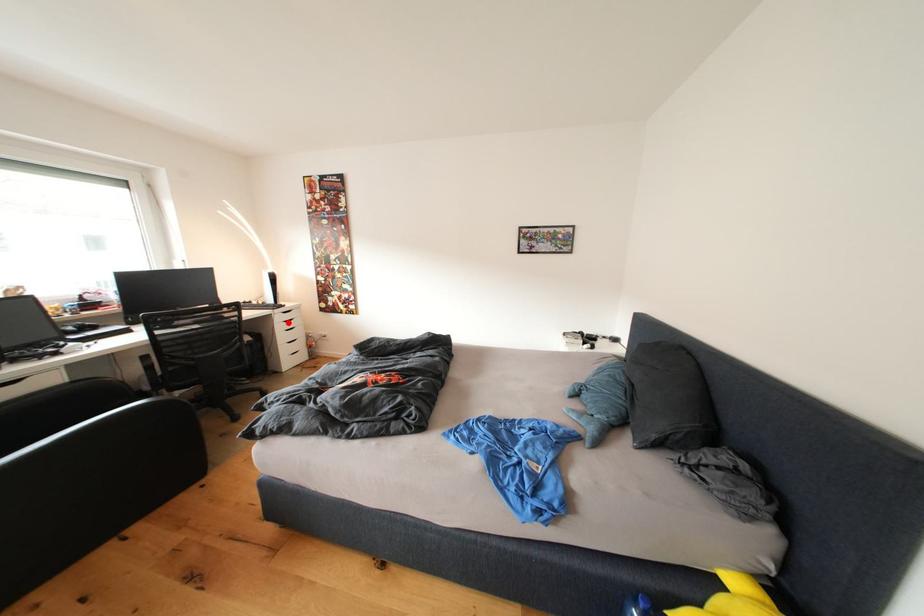
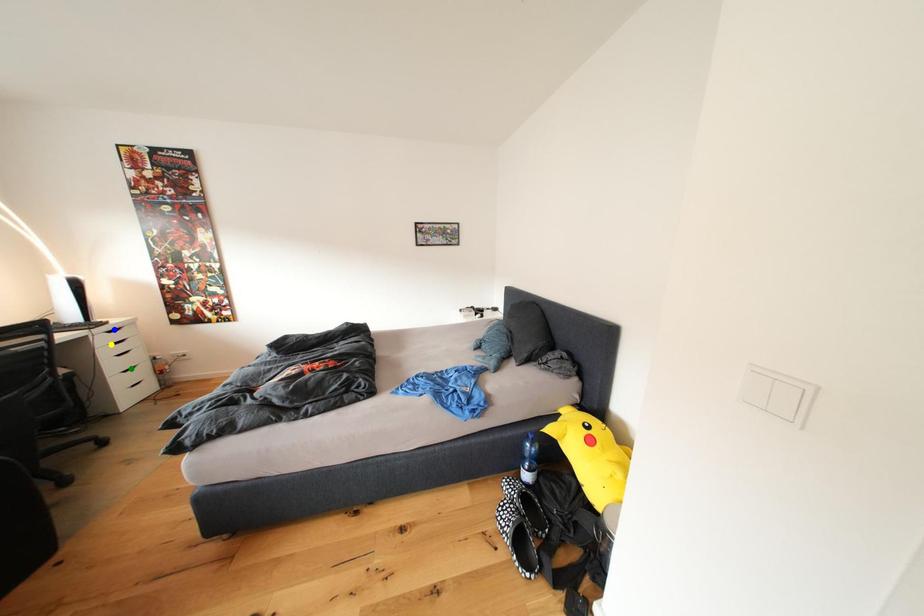
Question: I am providing you with two images of the same scene from different viewpoints. A red point is marked on the first image. You are given multiple points on the second image. Which point in image 2 represents the same 3d spot as the red point in image 1?

Choices:
 (A) yellow point
 (B) blue point
 (C) green point

Answer: (A)